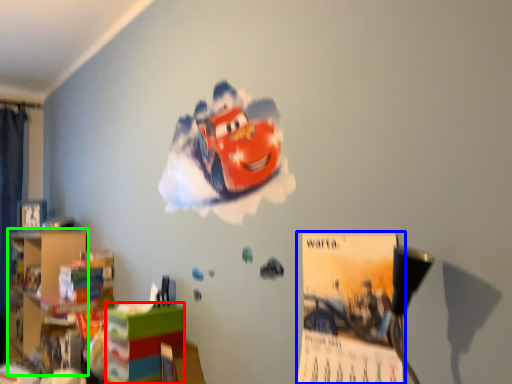
Question: Which is nearer to the shelf (highlighted by a red box)? poster page (highlighted by a blue box) or bookshelf (highlighted by a green box).

Choices:
 (A) poster page
 (B) bookshelf

Answer: (A)